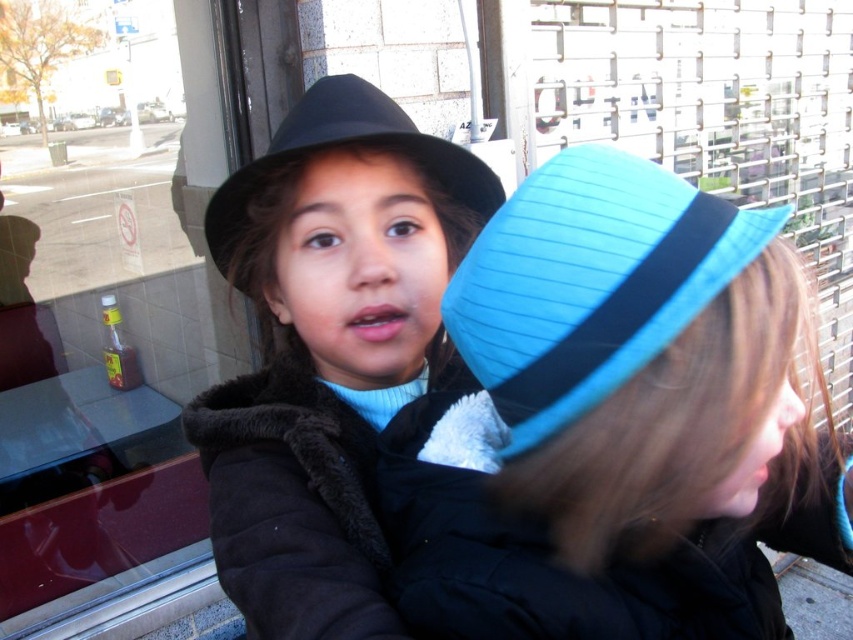
Consider the image. Can you confirm if matte black hat at center is wider than matte black fedora at center?

Yes, matte black hat at center is wider than matte black fedora at center.

Between point (233, 196) and point (236, 227), which one is positioned behind?

The point (236, 227) is behind.

Measure the distance between point [286,264] and camera.

They are 29.10 inches apart.

Where is `matte black hat at center`? Image resolution: width=853 pixels, height=640 pixels. matte black hat at center is located at coordinates (328, 349).

In the scene shown: Is blue felt hat at upper center wider than matte black fedora at center?

Yes.

Is point (851, 547) positioned before point (378, 129)?

No, (851, 547) is further to viewer.

Find the location of `blue felt hat at upper center`. blue felt hat at upper center is located at coordinates (616, 420).

Between matte black hat at center and blue fabric hat at upper right, which one has more height?

matte black hat at center is taller.

Is matte black hat at center to the right of blue fabric hat at upper right from the viewer's perspective?

No, matte black hat at center is not to the right of blue fabric hat at upper right.

Is point (354, 612) farther from camera compared to point (535, 180)?

Yes, point (354, 612) is behind point (535, 180).

Locate an element on the screen. Image resolution: width=853 pixels, height=640 pixels. matte black hat at center is located at coordinates (328, 349).